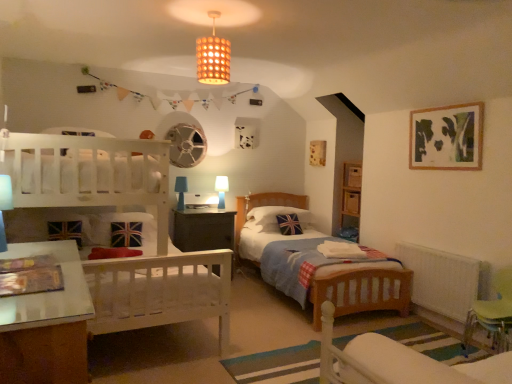
Question: Is the surface of green plastic swivel chair at lower right, the 2th swivel chair in the left-to-right sequence, in direct contact with white wooden bunk bed at left?

Choices:
 (A) no
 (B) yes

Answer: (A)

Question: Can you confirm if green plastic swivel chair at lower right, which appears as the first swivel chair when viewed from the back, is thinner than white wooden bunk bed at left?

Choices:
 (A) no
 (B) yes

Answer: (B)

Question: Is green plastic swivel chair at lower right, the 2th swivel chair in the left-to-right sequence, at the left side of white wooden bunk bed at left?

Choices:
 (A) yes
 (B) no

Answer: (B)

Question: From the image's perspective, is green plastic swivel chair at lower right, the 2th swivel chair when ordered from front to back, on white wooden bunk bed at left?

Choices:
 (A) yes
 (B) no

Answer: (B)

Question: Is green plastic swivel chair at lower right, the first swivel chair from the right, at the right side of white wooden bunk bed at left?

Choices:
 (A) yes
 (B) no

Answer: (A)

Question: From the image's perspective, is wooden lampshade at upper center located above or below green plastic swivel chair at lower right, which appears as the first swivel chair when viewed from the front?

Choices:
 (A) above
 (B) below

Answer: (A)

Question: In terms of size, does wooden lampshade at upper center appear bigger or smaller than green plastic swivel chair at lower right, which appears as the first swivel chair when viewed from the front?

Choices:
 (A) small
 (B) big

Answer: (A)

Question: Does point (209, 79) appear closer or farther from the camera than point (327, 350)?

Choices:
 (A) farther
 (B) closer

Answer: (A)

Question: In the image, is wooden lampshade at upper center positioned in front of or behind green plastic swivel chair at lower right, which appears as the first swivel chair when viewed from the front?

Choices:
 (A) behind
 (B) front

Answer: (A)

Question: Considering the positions of green plastic swivel chair at lower right, which appears as the 2th swivel chair when viewed from the back, and white wooden bunk bed at left in the image, is green plastic swivel chair at lower right, which appears as the 2th swivel chair when viewed from the back, taller or shorter than white wooden bunk bed at left?

Choices:
 (A) short
 (B) tall

Answer: (A)

Question: Is point (378, 354) positioned closer to the camera than point (113, 276)?

Choices:
 (A) closer
 (B) farther

Answer: (A)

Question: From a real-world perspective, relative to white wooden bunk bed at left, is green plastic swivel chair at lower right, which appears as the 2th swivel chair when viewed from the back, vertically above or below?

Choices:
 (A) below
 (B) above

Answer: (A)

Question: Is green plastic swivel chair at lower right, which appears as the first swivel chair when viewed from the front, in front of or behind white wooden bunk bed at left in the image?

Choices:
 (A) behind
 (B) front

Answer: (B)

Question: From a real-world perspective, is green plastic swivel chair at lower right, the 2th swivel chair when ordered from front to back, positioned above or below blue fabric pillow at center?

Choices:
 (A) below
 (B) above

Answer: (A)

Question: Which is correct: green plastic swivel chair at lower right, the 2th swivel chair when ordered from front to back, is inside blue fabric pillow at center, or outside of it?

Choices:
 (A) outside
 (B) inside

Answer: (A)